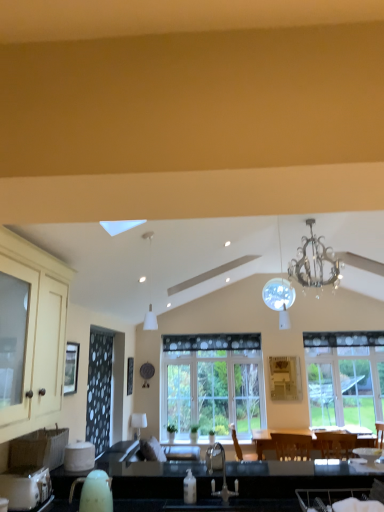
Locate an element on the screen. The image size is (384, 512). matte cream cabinet at left is located at coordinates (38, 330).

Locate an element on the screen. The width and height of the screenshot is (384, 512). clear glass window screen at left is located at coordinates (71, 368).

Describe the element at coordinates (71, 368) in the screenshot. I see `clear glass window screen at left` at that location.

Where is `white glossy lampshade at upper center`? white glossy lampshade at upper center is located at coordinates (138, 422).

The width and height of the screenshot is (384, 512). Identify the location of black matte sink at lower center. (219, 470).

From the picture: From a real-world perspective, which is physically below, white glossy toaster at lower left or velvet dark brown armchair at lower right?

velvet dark brown armchair at lower right.

Based on the photo, is white glossy toaster at lower left in contact with velvet dark brown armchair at lower right?

No, white glossy toaster at lower left is not in contact with velvet dark brown armchair at lower right.

Does white glossy toaster at lower left turn towards velvet dark brown armchair at lower right?

Yes, white glossy toaster at lower left is facing velvet dark brown armchair at lower right.

Is white glossy toaster at lower left not inside velvet dark brown armchair at lower right?

That's correct, white glossy toaster at lower left is outside of velvet dark brown armchair at lower right.

Is matte cream cabinet at left located outside silver metallic chandelier at upper center, marked as the second light fixture in a front-to-back arrangement?

matte cream cabinet at left is positioned outside silver metallic chandelier at upper center, marked as the second light fixture in a front-to-back arrangement.

Is matte cream cabinet at left closer to the viewer compared to silver metallic chandelier at upper center, the second light fixture when ordered from left to right?

Yes, the depth of matte cream cabinet at left is less than that of silver metallic chandelier at upper center, the second light fixture when ordered from left to right.

Is matte cream cabinet at left positioned with its back to silver metallic chandelier at upper center, which is counted as the 1th light fixture, starting from the right?

No, matte cream cabinet at left's orientation is not away from silver metallic chandelier at upper center, which is counted as the 1th light fixture, starting from the right.

Is white matte pendant light at upper center, the first light fixture when ordered from left to right, situated inside white glossy toaster at lower left or outside?

white matte pendant light at upper center, the first light fixture when ordered from left to right, is not inside white glossy toaster at lower left, it's outside.

Can you confirm if white matte pendant light at upper center, the first light fixture when ordered from left to right, is thinner than white glossy toaster at lower left?

Yes.

Which object is more forward, white matte pendant light at upper center, marked as the 2th light fixture in a right-to-left arrangement, or white glossy toaster at lower left?

Positioned in front is white glossy toaster at lower left.

From the image's perspective, relative to white glossy toaster at lower left, is white matte pendant light at upper center, the first light fixture when ordered from left to right, above or below?

Based on their image positions, white matte pendant light at upper center, the first light fixture when ordered from left to right, is located above white glossy toaster at lower left.

Is clear glass window at center, which is the 2th window in left-to-right order, thinner than white matte pendant light at upper center, arranged as the first light fixture when viewed from the front?

In fact, clear glass window at center, which is the 2th window in left-to-right order, might be wider than white matte pendant light at upper center, arranged as the first light fixture when viewed from the front.

In the image, is clear glass window at center, which is the 2th window in left-to-right order, on the left side or the right side of white matte pendant light at upper center, arranged as the first light fixture when viewed from the front?

In the image, clear glass window at center, which is the 2th window in left-to-right order, appears on the right side of white matte pendant light at upper center, arranged as the first light fixture when viewed from the front.

From the image's perspective, is clear glass window at center, which is the 2th window in left-to-right order, above or below white matte pendant light at upper center, arranged as the first light fixture when viewed from the front?

clear glass window at center, which is the 2th window in left-to-right order, is below white matte pendant light at upper center, arranged as the first light fixture when viewed from the front.

Considering the sizes of objects clear glass window at center, which is the 2th window in left-to-right order, and white matte pendant light at upper center, marked as the 2th light fixture in a right-to-left arrangement, in the image provided, who is smaller, clear glass window at center, which is the 2th window in left-to-right order, or white matte pendant light at upper center, marked as the 2th light fixture in a right-to-left arrangement,?

white matte pendant light at upper center, marked as the 2th light fixture in a right-to-left arrangement.

The width and height of the screenshot is (384, 512). In the image, there is a white matte pendant light at upper center, arranged as the first light fixture when viewed from the front. Find the location of `window screen below it (from a real-world perspective)`. window screen below it (from a real-world perspective) is located at coordinates (71, 368).

Considering the positions of objects white matte pendant light at upper center, arranged as the first light fixture when viewed from the front, and clear glass window screen at left in the image provided, who is more to the left, white matte pendant light at upper center, arranged as the first light fixture when viewed from the front, or clear glass window screen at left?

clear glass window screen at left.

Who is taller, white matte pendant light at upper center, arranged as the first light fixture when viewed from the front, or clear glass window screen at left?

white matte pendant light at upper center, arranged as the first light fixture when viewed from the front, is taller.

Considering the sizes of objects velvet dark brown armchair at lower right and white glossy toaster at lower left in the image provided, who is taller, velvet dark brown armchair at lower right or white glossy toaster at lower left?

Standing taller between the two is white glossy toaster at lower left.

Which is more to the right, velvet dark brown armchair at lower right or white glossy toaster at lower left?

velvet dark brown armchair at lower right.

Is white glossy toaster at lower left located within velvet dark brown armchair at lower right?

Definitely not — white glossy toaster at lower left is not inside velvet dark brown armchair at lower right.

In terms of size, does matte cream cabinet at left appear bigger or smaller than white matte pendant light at upper center, the first light fixture when ordered from left to right?

Clearly, matte cream cabinet at left is larger in size than white matte pendant light at upper center, the first light fixture when ordered from left to right.

Which point is more distant from viewer, (64, 364) or (146, 236)?

The point (64, 364) is farther from the camera.

Is matte cream cabinet at left not close to white matte pendant light at upper center, arranged as the second light fixture when viewed from the back?

Indeed, matte cream cabinet at left is not near white matte pendant light at upper center, arranged as the second light fixture when viewed from the back.

Which is more to the left, matte cream cabinet at left or white matte pendant light at upper center, arranged as the first light fixture when viewed from the front?

matte cream cabinet at left.

This screenshot has height=512, width=384. In order to click on armchair below the white glossy toaster at lower left (from a real-world perspective) in this screenshot , I will do `click(328, 497)`.

You are a GUI agent. You are given a task and a screenshot of the screen. Output one action in this format:
    pyautogui.click(x=<x>, y=<y>)
    Task: Click on the cabinetry on the left of silver metallic chandelier at upper center, marked as the second light fixture in a front-to-back arrangement
    Image resolution: width=384 pixels, height=512 pixels.
    Given the screenshot: What is the action you would take?
    pyautogui.click(x=38, y=330)

Looking at the image, which one is located further to white glossy lampshade at upper center, velvet dark brown armchair at lower right or clear glass window at center, the 1th window in the left-to-right sequence?

Among the two, velvet dark brown armchair at lower right is located further to white glossy lampshade at upper center.

When comparing their distances from matte cream cabinet at left, does silver metallic chandelier at upper center, which ranks as the first light fixture in back-to-front order, or clear glass window screen at left seem closer?

clear glass window screen at left.

Estimate the real-world distances between objects in this image. Which object is further from silver metallic chandelier at upper center, which is counted as the 1th light fixture, starting from the right, matte cream cabinet at left or white glossy toaster at lower left?

Among the two, white glossy toaster at lower left is located further to silver metallic chandelier at upper center, which is counted as the 1th light fixture, starting from the right.

Which object lies further to the anchor point clear glass window at center, which ranks as the 1th window in right-to-left order, clear glass window at center, the 1th window in the left-to-right sequence, or clear glass window screen at left?

The object further to clear glass window at center, which ranks as the 1th window in right-to-left order, is clear glass window screen at left.

When comparing their distances from white glossy toaster at lower left, does velvet dark brown armchair at lower right or silver metallic chandelier at upper center, which is counted as the 1th light fixture, starting from the right, seem closer?

velvet dark brown armchair at lower right is positioned closer to the anchor white glossy toaster at lower left.

Which object lies nearer to the anchor point white matte pendant light at upper center, marked as the 2th light fixture in a right-to-left arrangement, white glossy toaster at lower left or clear glass window at center, which is the 2th window in left-to-right order?

The object closer to white matte pendant light at upper center, marked as the 2th light fixture in a right-to-left arrangement, is clear glass window at center, which is the 2th window in left-to-right order.

Consider the image. From the image, which object appears to be nearer to matte cream cabinet at left, white matte pendant light at upper center, arranged as the second light fixture when viewed from the back, or silver metallic chandelier at upper center, which is counted as the 1th light fixture, starting from the right?

The object closer to matte cream cabinet at left is silver metallic chandelier at upper center, which is counted as the 1th light fixture, starting from the right.

Looking at the image, which one is located closer to white matte pendant light at upper center, the first light fixture when ordered from left to right, clear glass window screen at left or matte cream cabinet at left?

clear glass window screen at left.

This screenshot has height=512, width=384. I want to click on sink positioned between velvet dark brown armchair at lower right and white glossy lampshade at upper center from near to far, so click(219, 470).

Find the location of a particular element. This screenshot has width=384, height=512. window screen positioned between white glossy toaster at lower left and white glossy lampshade at upper center from near to far is located at coordinates (71, 368).

Where is `window between white glossy lampshade at upper center and clear glass window at center, which is the 2th window in left-to-right order`? window between white glossy lampshade at upper center and clear glass window at center, which is the 2th window in left-to-right order is located at coordinates (213, 383).

I want to click on appliance between matte cream cabinet at left and black matte sink at lower center in the horizontal direction, so click(25, 487).